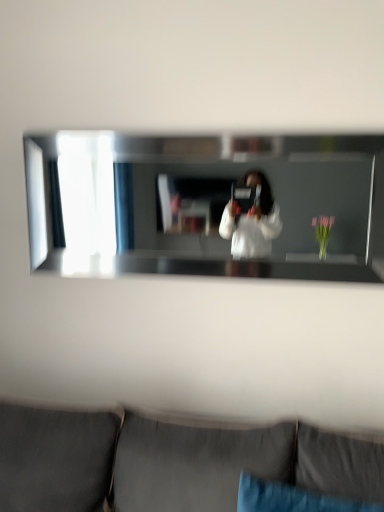
Image resolution: width=384 pixels, height=512 pixels. What do you see at coordinates (203, 205) in the screenshot?
I see `clear glass mirror at center` at bounding box center [203, 205].

Describe the element at coordinates (293, 499) in the screenshot. I see `blue fabric pillow at lower center` at that location.

This screenshot has width=384, height=512. I want to click on clear glass mirror at center, so click(x=203, y=205).

From the image's perspective, which one is positioned lower, blue fabric pillow at lower center or clear glass mirror at center?

blue fabric pillow at lower center.

Is blue fabric pillow at lower center at the right side of clear glass mirror at center?

Yes.

From a real-world perspective, is blue fabric pillow at lower center physically above clear glass mirror at center?

No.

Which is farther from the camera, (379,504) or (342,215)?

The point (342,215) is farther.

Can you confirm if clear glass mirror at center is shorter than dark gray fabric couch at lower center?

Yes.

Could you tell me if clear glass mirror at center is facing dark gray fabric couch at lower center?

No, clear glass mirror at center is not oriented towards dark gray fabric couch at lower center.

Is point (140, 191) positioned behind point (42, 446)?

That is True.

From the picture: Are dark gray fabric couch at lower center and clear glass mirror at center making contact?

No, dark gray fabric couch at lower center is not making contact with clear glass mirror at center.

Which object is closer to the camera taking this photo, dark gray fabric couch at lower center or clear glass mirror at center?

dark gray fabric couch at lower center is more forward.

From the picture: From a real-world perspective, between dark gray fabric couch at lower center and clear glass mirror at center, who is vertically lower?

In real-world perspective, dark gray fabric couch at lower center is lower.

From the picture: From the image's perspective, would you say dark gray fabric couch at lower center is positioned over clear glass mirror at center?

Incorrect, from the image's perspective, dark gray fabric couch at lower center is lower than clear glass mirror at center.

Based on the photo, considering the positions of objects clear glass mirror at center and blue fabric pillow at lower center in the image provided, who is in front, clear glass mirror at center or blue fabric pillow at lower center?

blue fabric pillow at lower center is closer to the camera.

Does clear glass mirror at center have a lesser width compared to blue fabric pillow at lower center?

Indeed, clear glass mirror at center has a lesser width compared to blue fabric pillow at lower center.

Can you tell me how much clear glass mirror at center and blue fabric pillow at lower center differ in facing direction?

8.83 degrees separate the facing orientations of clear glass mirror at center and blue fabric pillow at lower center.

In the scene shown: Is clear glass mirror at center touching blue fabric pillow at lower center?

clear glass mirror at center and blue fabric pillow at lower center are not in contact.

From a real-world perspective, which object stands above the other?

From a 3D spatial view, blue fabric pillow at lower center is above.

Is blue fabric pillow at lower center not inside dark gray fabric couch at lower center?

Actually, blue fabric pillow at lower center is within dark gray fabric couch at lower center.

Considering the sizes of blue fabric pillow at lower center and dark gray fabric couch at lower center in the image, is blue fabric pillow at lower center taller or shorter than dark gray fabric couch at lower center?

In the image, blue fabric pillow at lower center appears to be shorter than dark gray fabric couch at lower center.

Which object is further away from the camera taking this photo, blue fabric pillow at lower center or dark gray fabric couch at lower center?

blue fabric pillow at lower center is further from the camera.

Is dark gray fabric couch at lower center positioned with its back to blue fabric pillow at lower center?

Yes, dark gray fabric couch at lower center is positioned with its back facing blue fabric pillow at lower center.

Is point (142, 470) in front of point (325, 496)?

No, it is behind (325, 496).

Is dark gray fabric couch at lower center positioned beyond the bounds of blue fabric pillow at lower center?

dark gray fabric couch at lower center lies outside blue fabric pillow at lower center's area.

Is dark gray fabric couch at lower center bigger or smaller than blue fabric pillow at lower center?

Considering their sizes, dark gray fabric couch at lower center takes up more space than blue fabric pillow at lower center.

Where is `pillow in front of the clear glass mirror at center`? The width and height of the screenshot is (384, 512). pillow in front of the clear glass mirror at center is located at coordinates (293, 499).

The height and width of the screenshot is (512, 384). Identify the location of studio couch that appears below the clear glass mirror at center (from a real-world perspective). (166, 462).

Estimate the real-world distances between objects in this image. Which object is closer to clear glass mirror at center, blue fabric pillow at lower center or dark gray fabric couch at lower center?

dark gray fabric couch at lower center lies closer to clear glass mirror at center than the other object.

When comparing their distances from dark gray fabric couch at lower center, does blue fabric pillow at lower center or clear glass mirror at center seem further?

clear glass mirror at center is further to dark gray fabric couch at lower center.

When comparing their distances from blue fabric pillow at lower center, does clear glass mirror at center or dark gray fabric couch at lower center seem further?

The object further to blue fabric pillow at lower center is clear glass mirror at center.

In the scene shown: Considering their positions, is dark gray fabric couch at lower center positioned closer to clear glass mirror at center than blue fabric pillow at lower center?

The object closer to clear glass mirror at center is dark gray fabric couch at lower center.

Considering their positions, is clear glass mirror at center positioned further to dark gray fabric couch at lower center than blue fabric pillow at lower center?

clear glass mirror at center is positioned further to the anchor dark gray fabric couch at lower center.

From the picture: Considering their positions, is dark gray fabric couch at lower center positioned closer to blue fabric pillow at lower center than clear glass mirror at center?

dark gray fabric couch at lower center.

You are a GUI agent. You are given a task and a screenshot of the screen. Output one action in this format:
    pyautogui.click(x=<x>, y=<y>)
    Task: Click on the pillow between clear glass mirror at center and dark gray fabric couch at lower center from top to bottom
    The width and height of the screenshot is (384, 512).
    Given the screenshot: What is the action you would take?
    pyautogui.click(x=293, y=499)